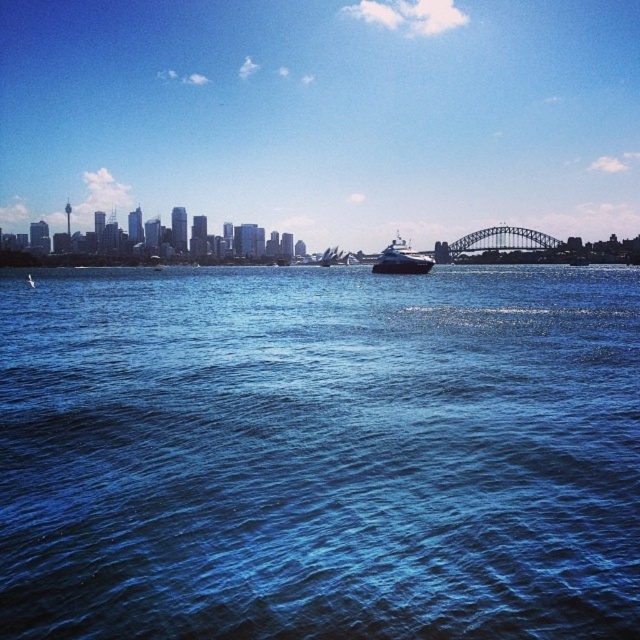
Which is behind, point (124, 328) or point (404, 259)?

Point (404, 259)

Is blue liquid water at center taller than shiny black yacht at center?

Yes, blue liquid water at center is taller than shiny black yacht at center.

Image resolution: width=640 pixels, height=640 pixels. What are the coordinates of `blue liquid water at center` in the screenshot? It's located at (320, 452).

This screenshot has width=640, height=640. Identify the location of blue liquid water at center. (320, 452).